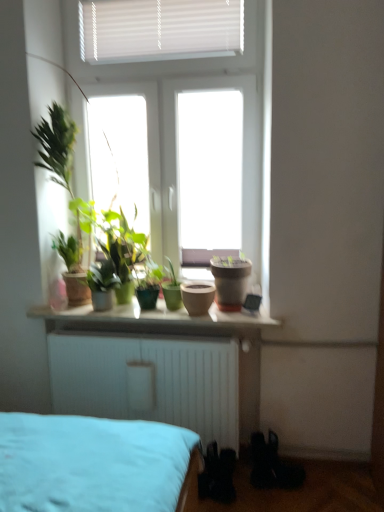
Question: Considering the positions of black matte shoe at lower right and matte ceramic pots at center in the image, is black matte shoe at lower right bigger or smaller than matte ceramic pots at center?

Choices:
 (A) big
 (B) small

Answer: (B)

Question: From the image's perspective, relative to matte ceramic pots at center, is black matte shoe at lower right above or below?

Choices:
 (A) above
 (B) below

Answer: (B)

Question: Based on their relative distances, which object is nearer to the matte ceramic pots at center?

Choices:
 (A) matte brown pot at center, acting as the first flowerpot starting from the right
 (B) green matte plant at center, which ranks as the 1th houseplant in left-to-right order
 (C) matte clay pot at center, which is counted as the 1th flowerpot, starting from the left
 (D) green matte plant at center, which ranks as the second houseplant in left-to-right order
 (E) black matte shoe at lower right

Answer: (C)

Question: Which is farther from the black matte shoe at lower right?

Choices:
 (A) green matte plant at center, which ranks as the second houseplant in left-to-right order
 (B) matte ceramic pots at center
 (C) green matte plant at center, arranged as the 2th houseplant when viewed from the right
 (D) matte brown pot at center, acting as the first flowerpot starting from the right
 (E) matte clay pot at center, which is counted as the 1th flowerpot, starting from the left

Answer: (C)